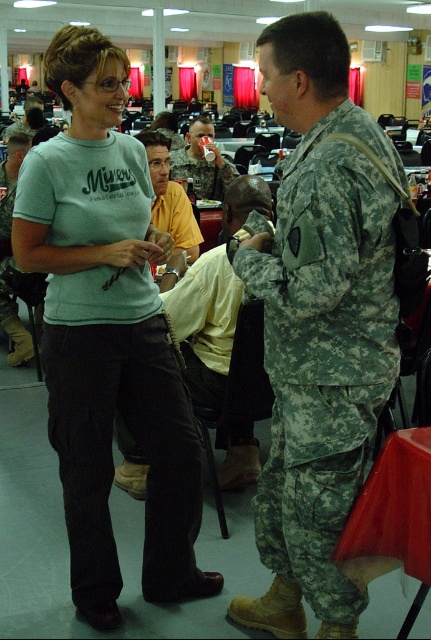
Does light blue t-shirt at center appear under camouflage fabric uniform at right?

No, light blue t-shirt at center is not below camouflage fabric uniform at right.

Is light blue t-shirt at center thinner than camouflage fabric uniform at right?

No, light blue t-shirt at center is not thinner than camouflage fabric uniform at right.

Find the location of a particular element. This screenshot has height=640, width=431. light blue t-shirt at center is located at coordinates (108, 333).

How distant is camouflage fabric uniform at right from camouflage uniform at center?

camouflage fabric uniform at right is 65.11 centimeters away from camouflage uniform at center.

Which is in front, point (336, 460) or point (121, 426)?

Point (336, 460) is more forward.

Between point (343, 116) and point (262, 204), which one is positioned in front?

Positioned in front is point (343, 116).

Where is `camouflage fabric uniform at right`? camouflage fabric uniform at right is located at coordinates (324, 349).

Who is shorter, camouflage fabric uniform at right or camouflage fabric uniform at center?

camouflage fabric uniform at center is shorter.

Which is above, camouflage fabric uniform at right or camouflage fabric uniform at center?

camouflage fabric uniform at center

Is point (393, 268) positioned before point (200, 150)?

Yes, it is in front of point (200, 150).

What are the coordinates of `camouflage fabric uniform at right` in the screenshot? It's located at [324, 349].